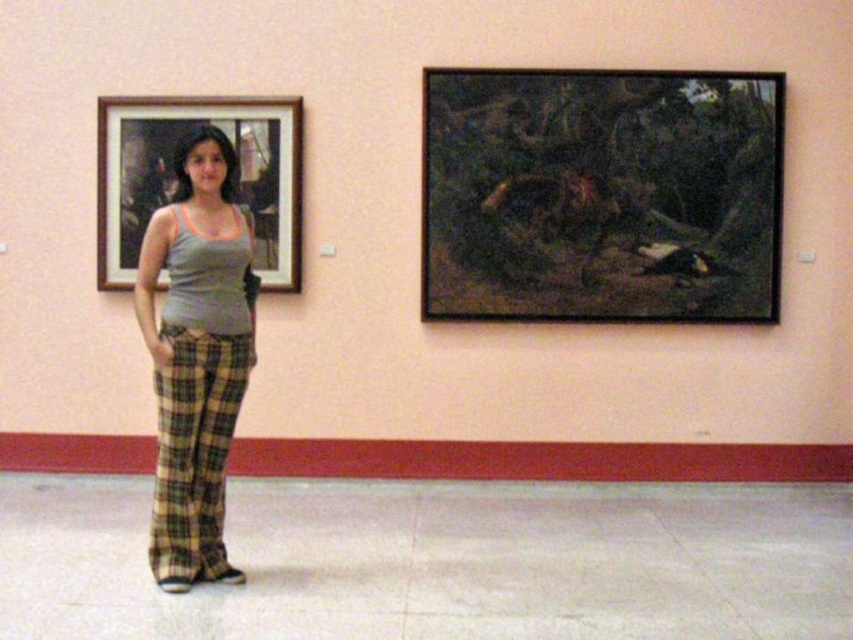
Does point (155, 189) come in front of point (184, 483)?

No, (155, 189) is behind (184, 483).

Does point (277, 172) come behind point (223, 420)?

That is True.

Where is `wooden framed portrait at left`? Image resolution: width=853 pixels, height=640 pixels. wooden framed portrait at left is located at coordinates (175, 180).

Is point (200, 214) in front of point (241, 577)?

Yes, point (200, 214) is in front of point (241, 577).

Is matte gray tank top at center below yellow plaid pants at center?

No.

Describe the element at coordinates (196, 356) in the screenshot. The height and width of the screenshot is (640, 853). I see `matte gray tank top at center` at that location.

You are a GUI agent. You are given a task and a screenshot of the screen. Output one action in this format:
    pyautogui.click(x=<x>, y=<y>)
    Task: Click on the matte gray tank top at center
    This screenshot has width=853, height=640.
    Given the screenshot: What is the action you would take?
    pyautogui.click(x=196, y=356)

Describe the element at coordinates (196, 356) in the screenshot. The height and width of the screenshot is (640, 853). I see `matte gray tank top at center` at that location.

Does point (194, 426) come closer to viewer compared to point (253, 144)?

Yes, it is.

Is point (161, 384) farther from viewer compared to point (119, 202)?

No.

Identify the location of matte gray tank top at center. (196, 356).